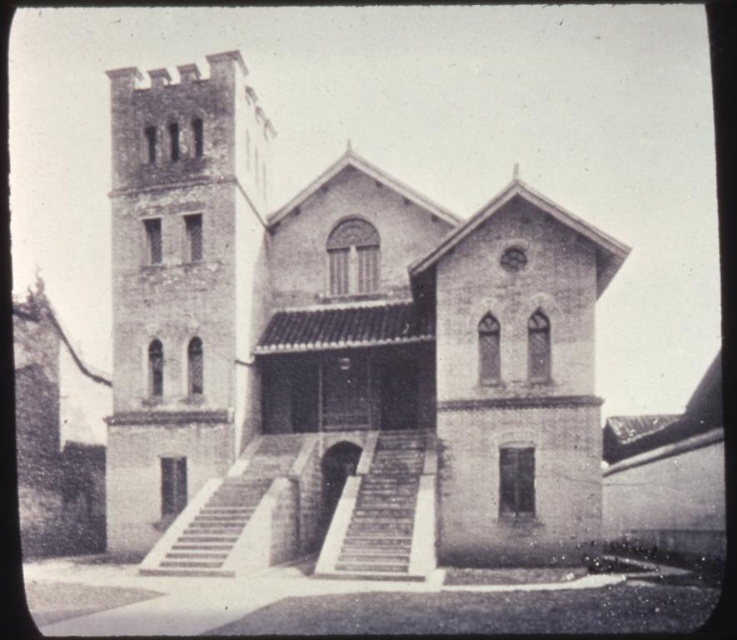
Consider the image. You are an architect visiting this historical building. You need to determine which structure occupies more space in the image between the brick tower at left and the smooth concrete stairs at center. Based on the scene, which one is bigger?

The brick tower at left is larger in size than the smooth concrete stairs at center, so the brick tower at left occupies more space in the image.

You are standing at the entrance of the brick chapel at center and want to enter. The stone textured stairs at center are in front of you. Are the stairs leading up to the chapel or down to a lower level?

The brick chapel at center is much taller than the stone textured stairs at center, so the stairs are leading up to the chapel.